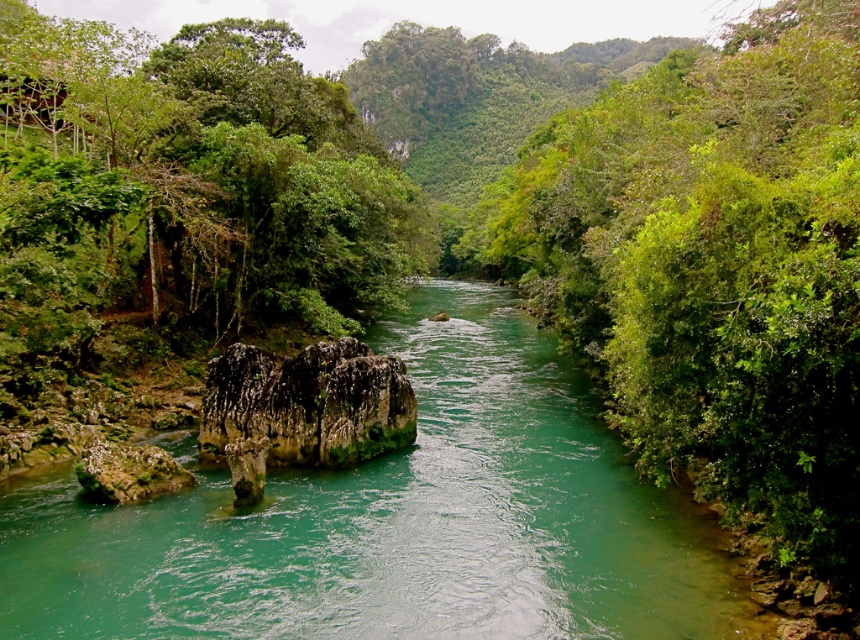
Question: Does green stone stream at center lie in front of green leafy tree at right?

Choices:
 (A) no
 (B) yes

Answer: (A)

Question: Which point is closer to the camera taking this photo?

Choices:
 (A) (740, 611)
 (B) (610, 122)

Answer: (A)

Question: Can you confirm if green stone stream at center is positioned to the right of green leafy tree at right?

Choices:
 (A) no
 (B) yes

Answer: (A)

Question: Is green stone stream at center positioned at the back of green leafy tree at right?

Choices:
 (A) no
 (B) yes

Answer: (B)